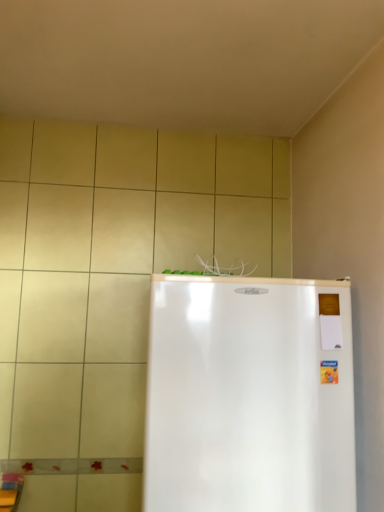
Describe the element at coordinates (249, 396) in the screenshot. I see `white glossy refrigerator at center` at that location.

You are a GUI agent. You are given a task and a screenshot of the screen. Output one action in this format:
    pyautogui.click(x=<x>, y=<y>)
    Task: Click on the white glossy refrigerator at center
    This screenshot has height=512, width=384.
    Given the screenshot: What is the action you would take?
    pyautogui.click(x=249, y=396)

The image size is (384, 512). What are the coordinates of `white glossy refrigerator at center` in the screenshot? It's located at (249, 396).